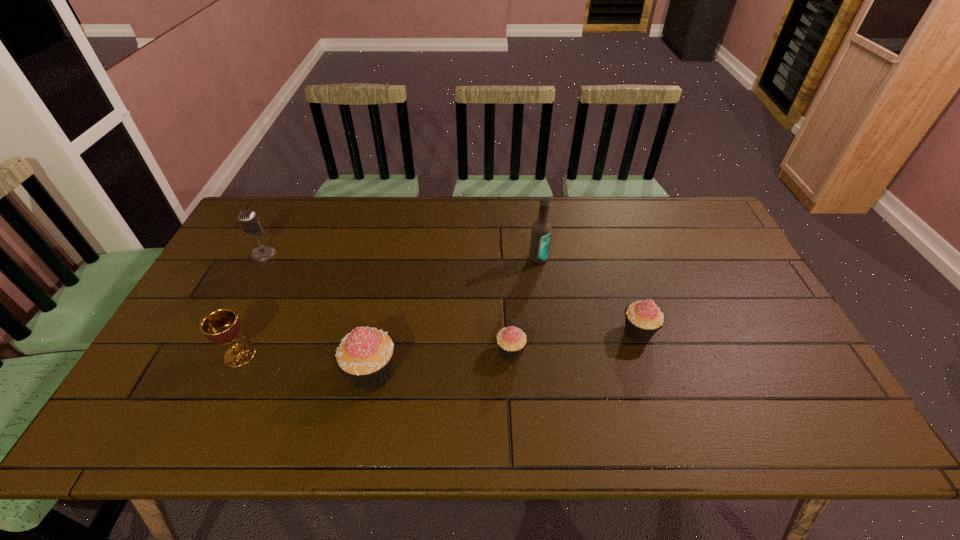
This screenshot has height=540, width=960. What are the coordinates of `free point that keeps the cupcakes evenly spaced on the right` in the screenshot? It's located at (756, 313).